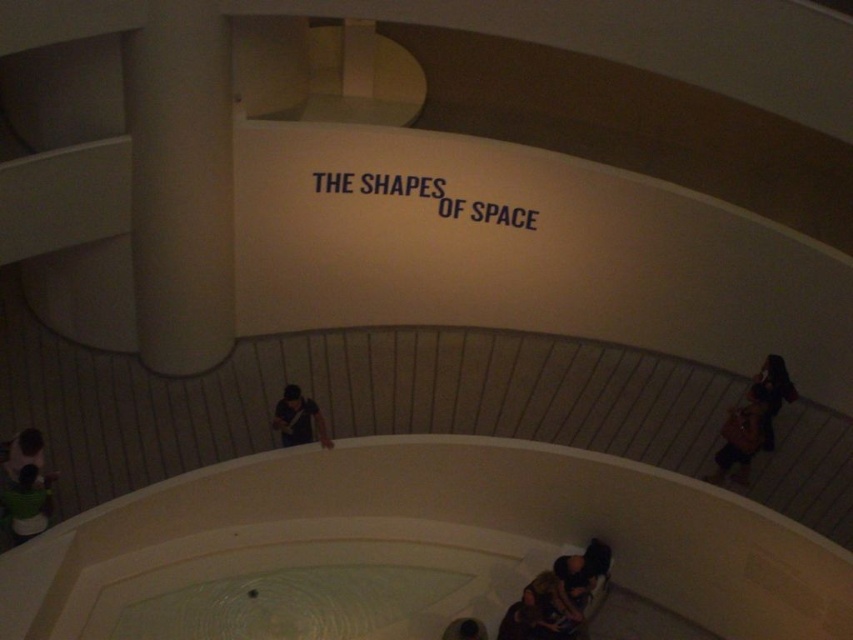
Image resolution: width=853 pixels, height=640 pixels. Describe the element at coordinates (752, 420) in the screenshot. I see `brown leather bag at lower right` at that location.

Does brown leather bag at lower right have a greater width compared to dark brown leather jacket at lower left?

Yes, brown leather bag at lower right is wider than dark brown leather jacket at lower left.

In order to click on brown leather bag at lower right in this screenshot , I will do `click(752, 420)`.

Consider the image. Between green fabric shirt at lower left and dark brown leather jacket at lower left, which one is positioned higher?

dark brown leather jacket at lower left

Measure the distance between green fabric shirt at lower left and dark brown leather jacket at lower left.

green fabric shirt at lower left is 30.83 centimeters from dark brown leather jacket at lower left.

Find the location of `green fabric shirt at lower left`. green fabric shirt at lower left is located at coordinates (26, 502).

Where is `green fabric shirt at lower left`? This screenshot has width=853, height=640. green fabric shirt at lower left is located at coordinates (26, 502).

Does green fabric shirt at lower left appear under matte black shirt at center?

Yes, green fabric shirt at lower left is below matte black shirt at center.

Does green fabric shirt at lower left have a greater width compared to matte black shirt at center?

No, green fabric shirt at lower left is not wider than matte black shirt at center.

This screenshot has width=853, height=640. I want to click on green fabric shirt at lower left, so click(x=26, y=502).